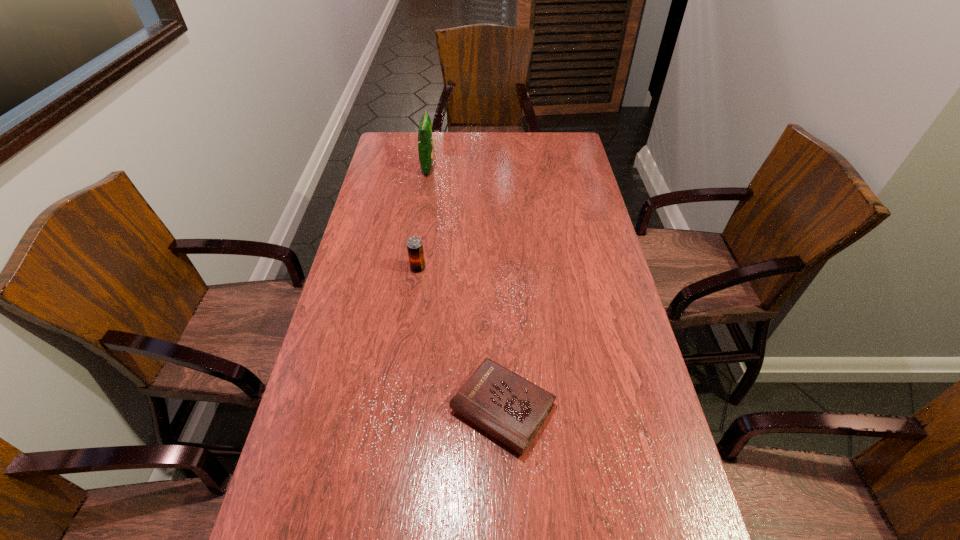
At what (x,y) coordinates should I click in order to perform the action: click on vacant area that lies between the crisp (potato chip) and the second nearest object. Please return your answer as a coordinate pair (x, y). Looking at the image, I should click on (423, 218).

This screenshot has height=540, width=960. I want to click on free spot between the tallest object and the second tallest object, so click(423, 218).

Find the location of a particular element. the closest object to the second nearest object is located at coordinates (510, 408).

This screenshot has height=540, width=960. In order to click on object that is the nearest to the second nearest object in this screenshot , I will do `click(510, 408)`.

The height and width of the screenshot is (540, 960). Identify the location of free location that satisfies the following two spatial constraints: 1. on the front-facing side of the tallest object; 2. on the right side of the beer can. (413, 268).

Identify the location of free space that satisfies the following two spatial constraints: 1. on the front side of the rightmost object; 2. on the right side of the beer can. Image resolution: width=960 pixels, height=540 pixels. (398, 409).

Find the location of `vacant space that satisfies the following two spatial constraints: 1. on the front-facing side of the tallest object; 2. on the back side of the rightmost object`. vacant space that satisfies the following two spatial constraints: 1. on the front-facing side of the tallest object; 2. on the back side of the rightmost object is located at coordinates (392, 409).

Find the location of a particular element. The height and width of the screenshot is (540, 960). free space that satisfies the following two spatial constraints: 1. on the back side of the hardback book; 2. on the front-facing side of the tallest object is located at coordinates (493, 167).

I want to click on vacant space that satisfies the following two spatial constraints: 1. on the front-facing side of the tallest object; 2. on the left side of the hardback book, so click(x=392, y=409).